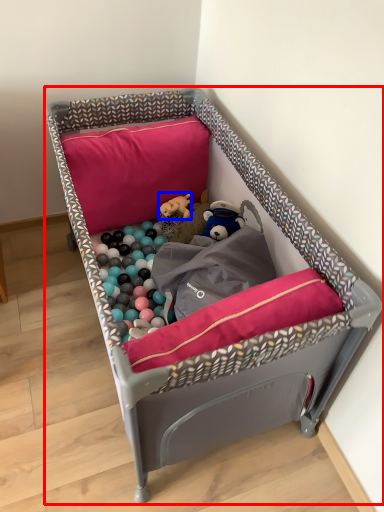
Question: Which of the following is the farthest to the observer, infant bed (highlighted by a red box) or toy (highlighted by a blue box)?

Choices:
 (A) infant bed
 (B) toy

Answer: (B)